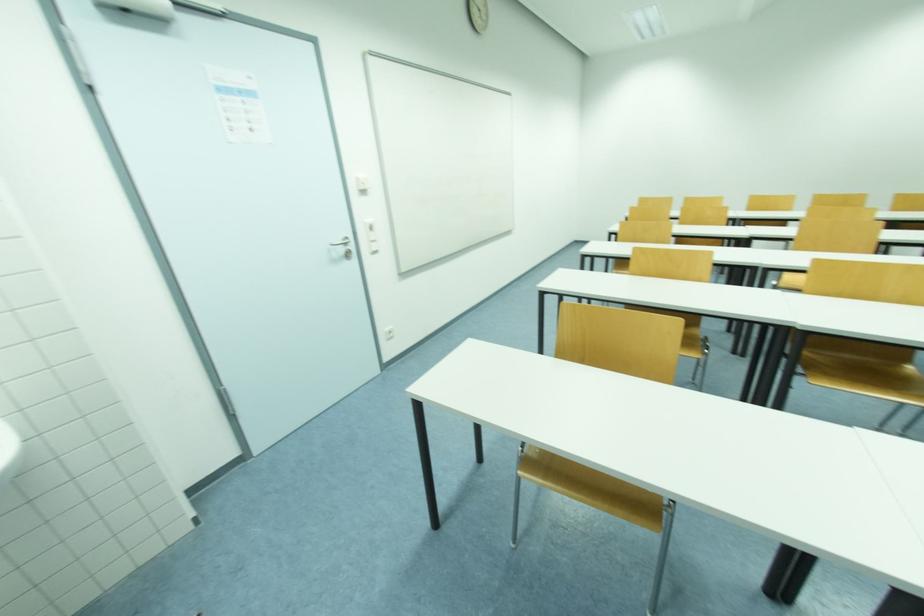
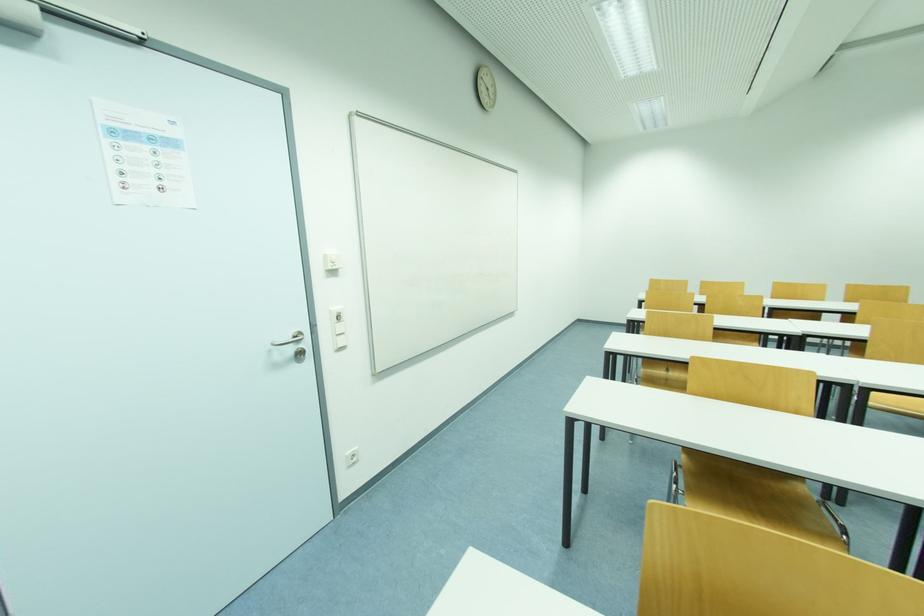
Question: The first image is from the beginning of the video and the second image is from the end. How did the camera likely rotate when shooting the video?

Choices:
 (A) Left
 (B) Right
 (C) Up
 (D) Down

Answer: (C)